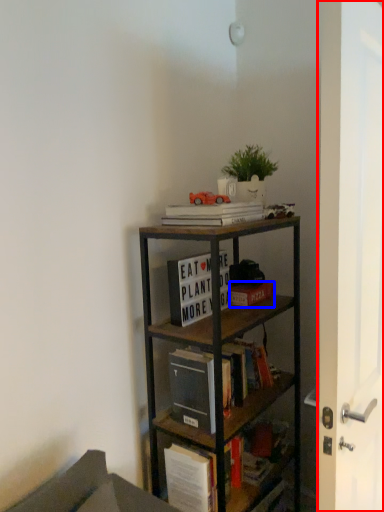
Question: Which object is closer to the camera taking this photo, glass door (highlighted by a red box) or book (highlighted by a blue box)?

Choices:
 (A) glass door
 (B) book

Answer: (A)